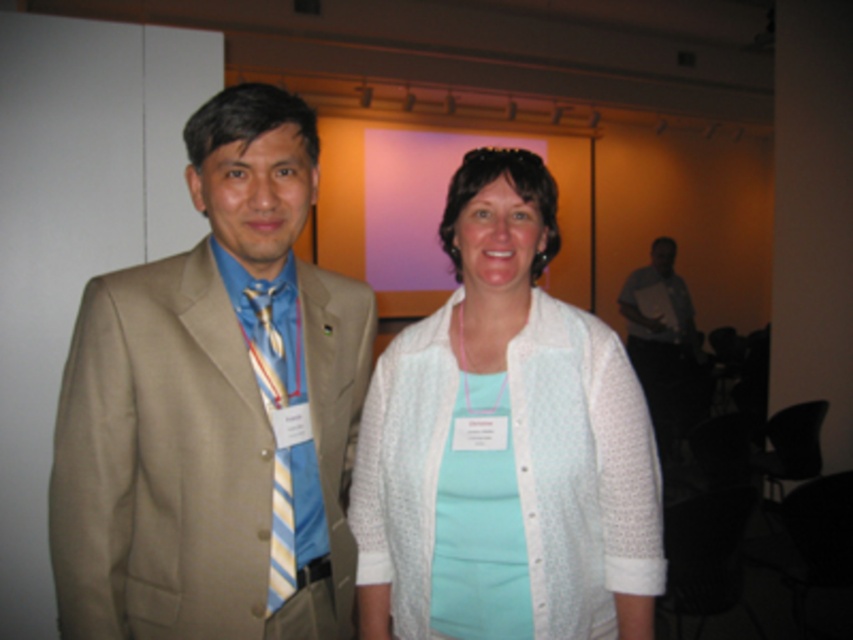
Is tan fabric suit at left below matte white neck at center?

Yes, tan fabric suit at left is below matte white neck at center.

Does tan fabric suit at left have a greater height compared to matte white neck at center?

Yes.

Does point (287, 472) come closer to viewer compared to point (529, 300)?

Yes, it is in front of point (529, 300).

Find the location of a particular element. tan fabric suit at left is located at coordinates (207, 452).

Which is below, tan fabric suit at left or white textured cardigan at center?

white textured cardigan at center is lower down.

Can you confirm if tan fabric suit at left is taller than white textured cardigan at center?

Indeed, tan fabric suit at left has a greater height compared to white textured cardigan at center.

Is point (129, 400) farther from camera compared to point (560, 531)?

No, it is in front of (560, 531).

Where is `tan fabric suit at left`? This screenshot has width=853, height=640. tan fabric suit at left is located at coordinates (207, 452).

Who is more forward, [276,416] or [502,298]?

Point [276,416] is in front.

You are a GUI agent. You are given a task and a screenshot of the screen. Output one action in this format:
    pyautogui.click(x=<x>, y=<y>)
    Task: Click on the striped silk tie at center
    
    Given the screenshot: What is the action you would take?
    [x=276, y=432]

Image resolution: width=853 pixels, height=640 pixels. What do you see at coordinates (276, 432) in the screenshot?
I see `striped silk tie at center` at bounding box center [276, 432].

This screenshot has width=853, height=640. In order to click on striped silk tie at center in this screenshot , I will do `click(276, 432)`.